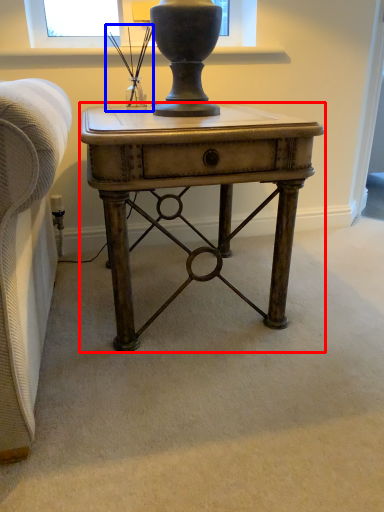
Question: Which of the following is the farthest to the observer, desk (highlighted by a red box) or table lamp (highlighted by a blue box)?

Choices:
 (A) desk
 (B) table lamp

Answer: (B)